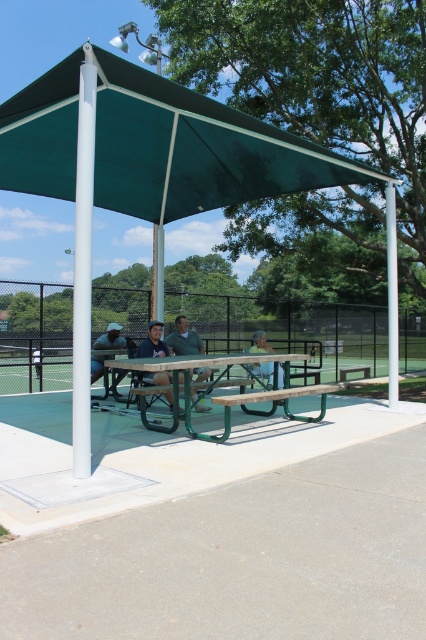
You are standing at point (253, 369) and want to walk to the picnic table under the green canopy. Is point (83, 65) located between you and the picnic table?

Point (83, 65) is in front of point (253, 369), so yes, it is between you and the picnic table under the green canopy.

You are standing at the picnic table under the green canopy and want to locate the matte blue shirt at center. Based on the coordinates given, in which direction relative to the picnic table should you look to find it?

The matte blue shirt at center is located at coordinates point (152, 342). Since the picnic table is under the canopy at the center, the shirt is directly in front of you.